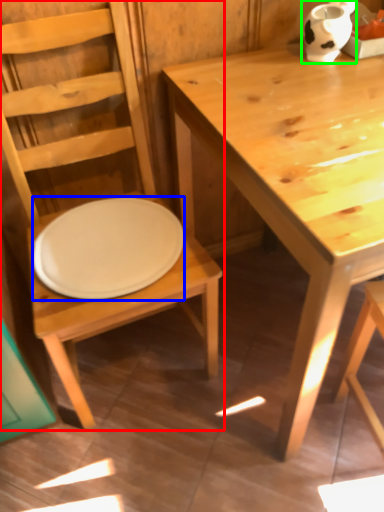
Question: Which object is the closest to the chair (highlighted by a red box)? Choose among these: plate (highlighted by a blue box) or vase (highlighted by a green box).

Choices:
 (A) plate
 (B) vase

Answer: (A)